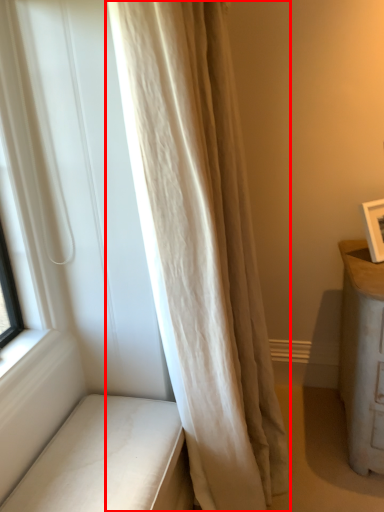
Question: From the image, what is the correct spatial relationship of curtain (annotated by the red box) in relation to furniture?

Choices:
 (A) right
 (B) left

Answer: (A)